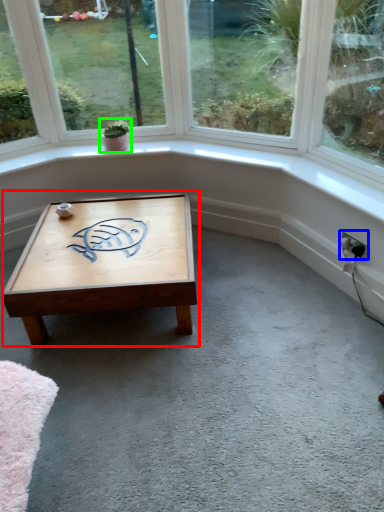
Question: Which is farther away from coffee table (highlighted by a red box)? electric outlet (highlighted by a blue box) or houseplant (highlighted by a green box)?

Choices:
 (A) electric outlet
 (B) houseplant

Answer: (A)